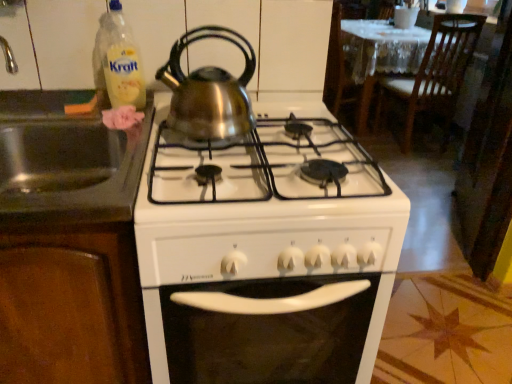
Question: Is white glossy gas stove at center at the left side of stained wood cabinet at left?

Choices:
 (A) yes
 (B) no

Answer: (B)

Question: Does white glossy gas stove at center have a larger size compared to stained wood cabinet at left?

Choices:
 (A) yes
 (B) no

Answer: (B)

Question: From a real-world perspective, does white glossy gas stove at center sit lower than stained wood cabinet at left?

Choices:
 (A) yes
 (B) no

Answer: (A)

Question: Can stained wood cabinet at left be found inside white glossy gas stove at center?

Choices:
 (A) yes
 (B) no

Answer: (B)

Question: From the image's perspective, is white glossy gas stove at center on top of stained wood cabinet at left?

Choices:
 (A) no
 (B) yes

Answer: (A)

Question: From a real-world perspective, is white glossy gas stove at center positioned over stained wood cabinet at left based on gravity?

Choices:
 (A) no
 (B) yes

Answer: (A)

Question: Considering the relative sizes of wooden chair at upper right and translucent plastic bottle at upper left in the image provided, is wooden chair at upper right taller than translucent plastic bottle at upper left?

Choices:
 (A) yes
 (B) no

Answer: (A)

Question: Is wooden chair at upper right not close to translucent plastic bottle at upper left?

Choices:
 (A) no
 (B) yes

Answer: (B)

Question: Is wooden chair at upper right looking in the opposite direction of translucent plastic bottle at upper left?

Choices:
 (A) no
 (B) yes

Answer: (A)

Question: From the image's perspective, is wooden chair at upper right located beneath translucent plastic bottle at upper left?

Choices:
 (A) yes
 (B) no

Answer: (B)

Question: Could you tell me if wooden chair at upper right is turned towards translucent plastic bottle at upper left?

Choices:
 (A) yes
 (B) no

Answer: (B)

Question: Considering the relative sizes of wooden chair at upper right and translucent plastic bottle at upper left in the image provided, is wooden chair at upper right wider than translucent plastic bottle at upper left?

Choices:
 (A) no
 (B) yes

Answer: (B)

Question: Considering the relative positions of stainless steel sink at left and wooden chair at upper right in the image provided, is stainless steel sink at left to the left of wooden chair at upper right from the viewer's perspective?

Choices:
 (A) yes
 (B) no

Answer: (A)